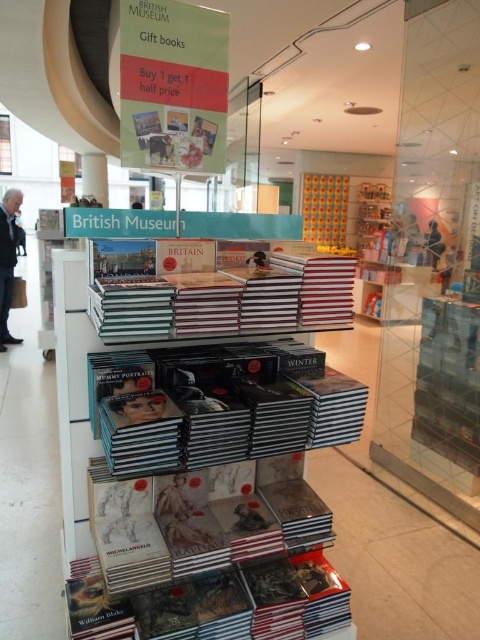
Between point (222, 632) and point (325, 442), which one is positioned in front?

Point (325, 442)

Between point (108, 412) and point (148, 376), which one is positioned behind?

Point (148, 376)

Where is `white matte book at center`? white matte book at center is located at coordinates (202, 456).

Is matte black book at center taller than hardcover book at center?

Indeed, matte black book at center has a greater height compared to hardcover book at center.

Between point (240, 392) and point (237, 269), which one is positioned behind?

The point (237, 269) is behind.

Find the location of a particular element. Image resolution: width=480 pixels, height=640 pixels. matte black book at center is located at coordinates coord(219,404).

Who is higher up, white matte book at center or hardcover book at center?

Positioned higher is hardcover book at center.

Which is below, white matte book at center or hardcover book at center?

white matte book at center

What do you see at coordinates (202, 456) in the screenshot? The width and height of the screenshot is (480, 640). I see `white matte book at center` at bounding box center [202, 456].

Where is `white matte book at center`? The height and width of the screenshot is (640, 480). white matte book at center is located at coordinates (202, 456).